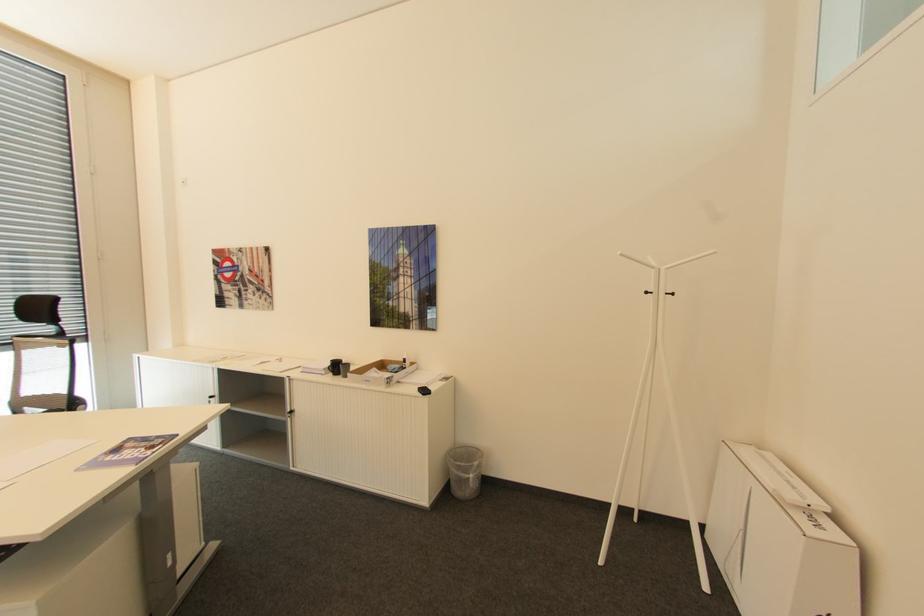
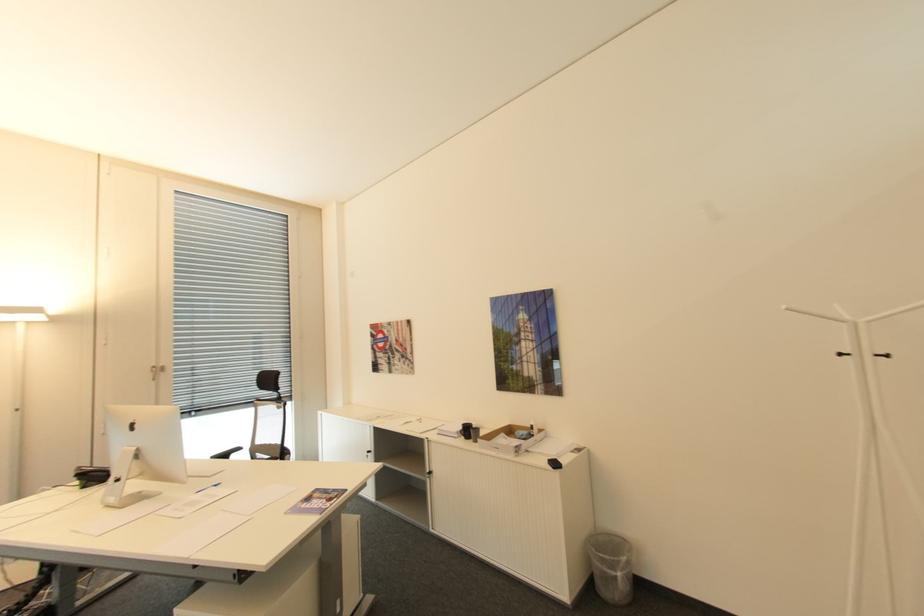
Find the pixel in the second image that matches pixel 336 360 in the first image.

(468, 424)